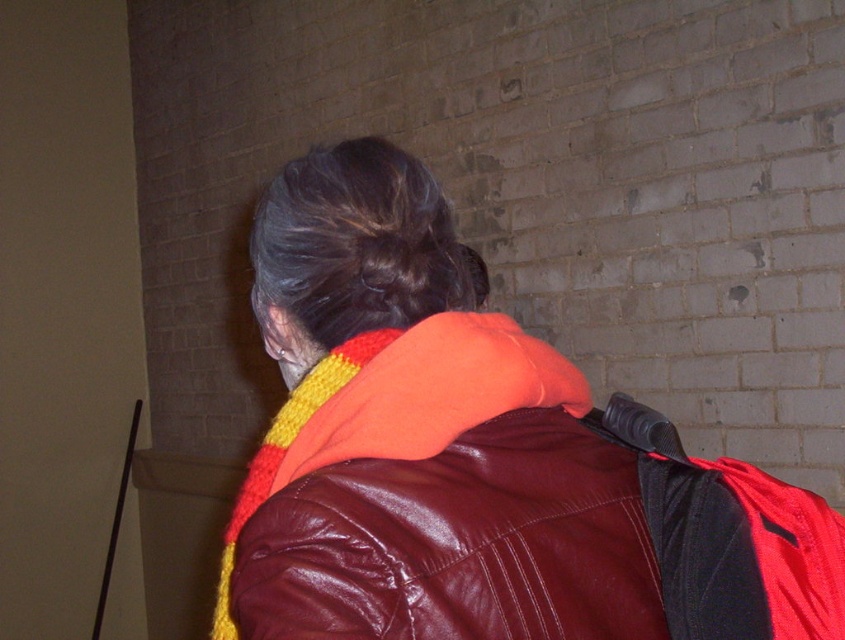
Based on the photo, is dark brown hair at center positioned before black leather backpack at upper right?

No.

Who is shorter, dark brown hair at center or black leather backpack at upper right?

With less height is black leather backpack at upper right.

Locate an element on the screen. The width and height of the screenshot is (845, 640). dark brown hair at center is located at coordinates (356, 244).

Which is more to the right, leather jacket at center or burgundy leather jacket at center?

Positioned to the right is burgundy leather jacket at center.

Is point (429, 465) behind point (459, 513)?

That is True.

Between point (609, 550) and point (532, 435), which one is positioned in front?

Point (609, 550) is more forward.

The image size is (845, 640). Identify the location of leather jacket at center. (417, 438).

Who is taller, burgundy leather jacket at center or black leather backpack at upper right?

Standing taller between the two is black leather backpack at upper right.

Does burgundy leather jacket at center have a larger size compared to black leather backpack at upper right?

Yes, burgundy leather jacket at center is bigger than black leather backpack at upper right.

Describe the element at coordinates (456, 544) in the screenshot. I see `burgundy leather jacket at center` at that location.

This screenshot has height=640, width=845. In order to click on burgundy leather jacket at center in this screenshot , I will do 456,544.